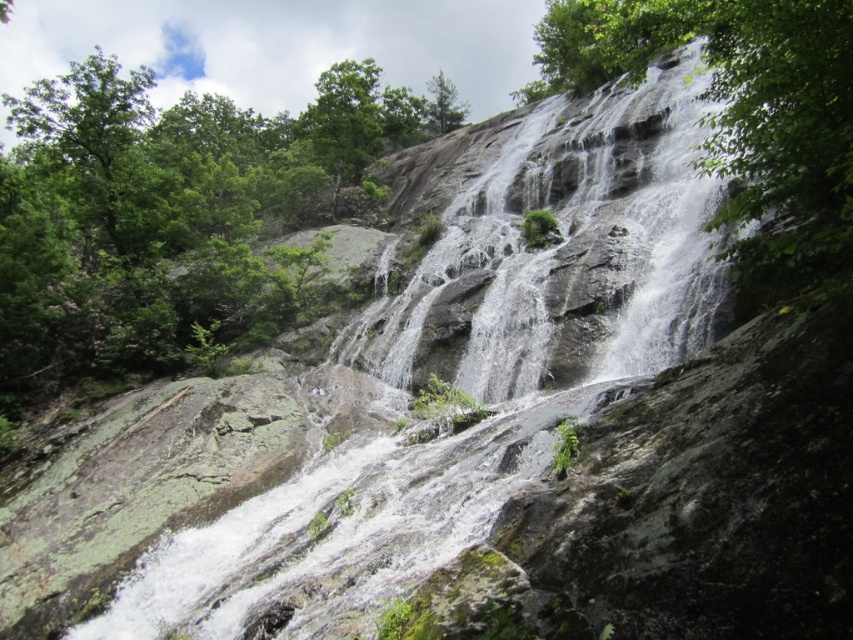
You are standing at the base of the gray rock waterfall at center and want to look up toward the green leafy tree at upper right. In which direction should you turn your head?

You should turn your head to the right to look toward the green leafy tree at upper right since the gray rock waterfall at center is to its left.

You are standing at the base of the waterfall and want to take a photo of both the green leafy tree at upper right and the green leafy tree at upper center. Which tree should you adjust your camera focus to first to ensure both are in the frame?

You should focus on the green leafy tree at upper right first since it is closer to you than the green leafy tree at upper center, allowing you to adjust the camera to include both in the frame.

You are standing at the base of the gray rock waterfall at center and want to climb up to the green leafy tree at upper center. Considering their heights, which one is shorter and would require less climbing effort?

The gray rock waterfall at center has a lesser height compared to the green leafy tree at upper center, so climbing to the gray rock waterfall at center would require less effort.